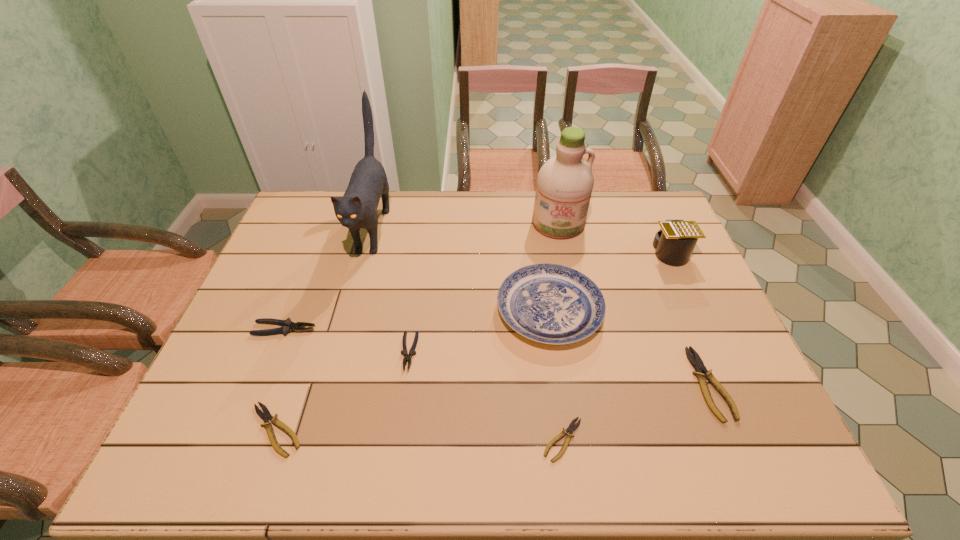
Where is `empty location between the leftmost yellow pliers and the gray cat`? empty location between the leftmost yellow pliers and the gray cat is located at coordinates (324, 329).

Locate an element on the screen. Image resolution: width=960 pixels, height=540 pixels. vacant space in between the tallest pliers and the calculator is located at coordinates (477, 291).

Where is `vacant space that is in between the cleansing agent and the leftmost yellow pliers`? vacant space that is in between the cleansing agent and the leftmost yellow pliers is located at coordinates (417, 327).

In order to click on free space that is in between the second shortest object and the cleansing agent in this screenshot , I will do `click(417, 327)`.

The image size is (960, 540). In order to click on the sixth closest object to the cleansing agent in this screenshot , I will do `click(571, 428)`.

I want to click on the closest object to the smallest yellow pliers, so click(x=549, y=303).

Locate an element on the screen. The height and width of the screenshot is (540, 960). pliers that is the closest to the fifth shortest object is located at coordinates (265, 415).

The image size is (960, 540). Identify the location of the second closest pliers relative to the rightmost pliers. (407, 357).

Choose which yellow pliers is the nearest neighbor to the plate. Please provide its 2D coordinates. Your answer should be formatted as a tuple, i.e. [(x, y)], where the tuple contains the x and y coordinates of a point satisfying the conditions above.

[(571, 428)]

Locate which yellow pliers ranks in proximity to the fourth pliers from left to right. Please provide its 2D coordinates. Your answer should be formatted as a tuple, i.e. [(x, y)], where the tuple contains the x and y coordinates of a point satisfying the conditions above.

[(702, 373)]